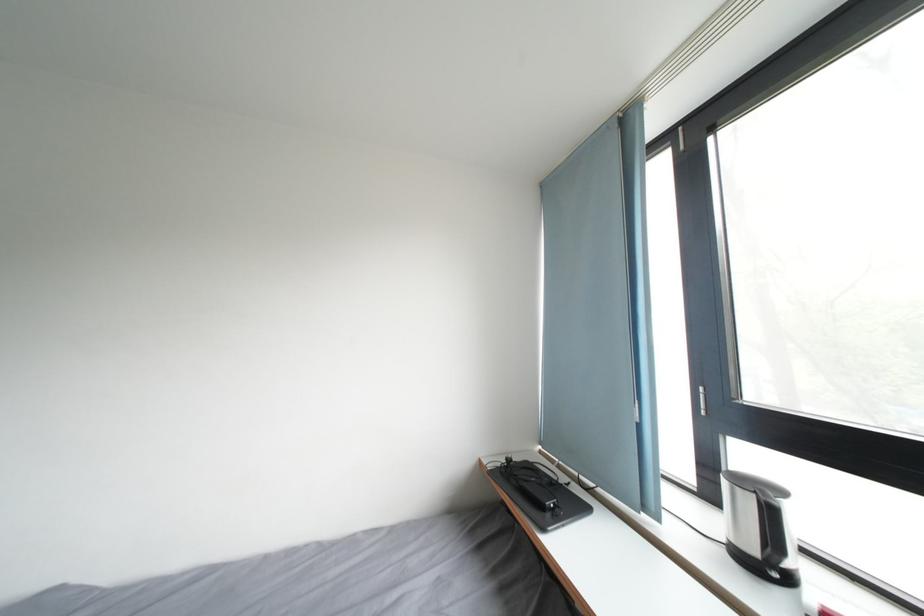
Describe the element at coordinates (775, 533) in the screenshot. This screenshot has width=924, height=616. I see `a black kettle handle` at that location.